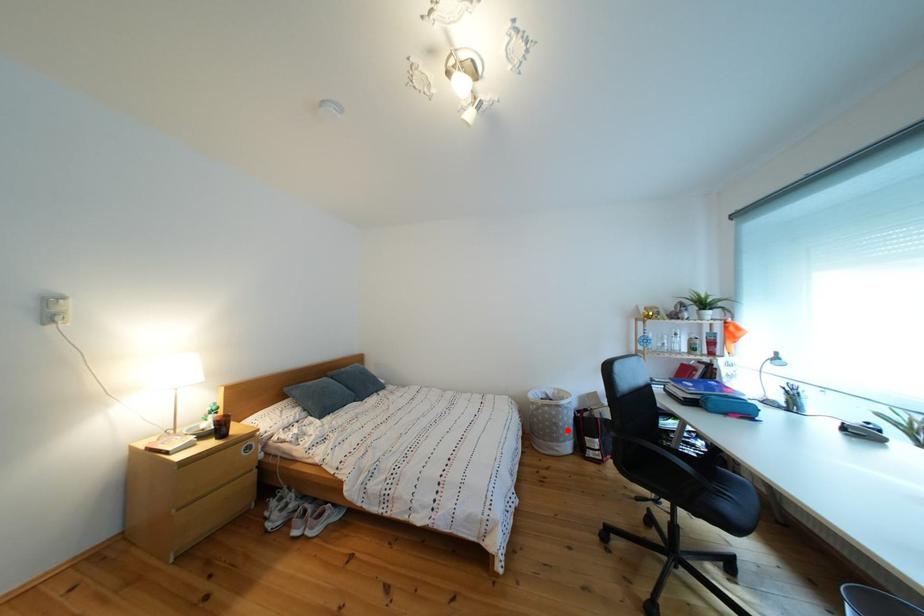
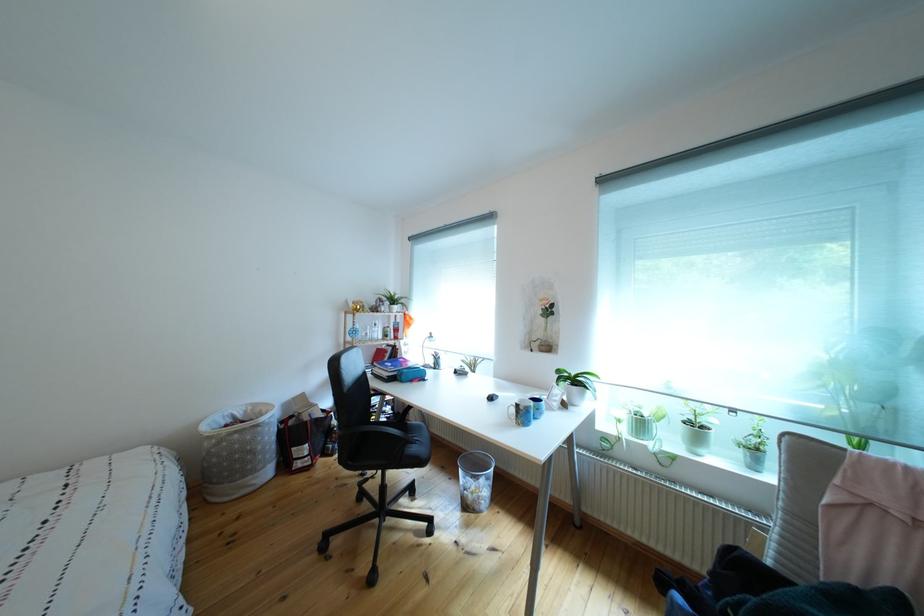
Question: I am providing you with two images of the same scene from different viewpoints. Image1 has a red point marked. In image2, the corresponding 3D location appears at what relative position? Reply with the corresponding letter.

Choices:
 (A) Closer
 (B) Farther

Answer: (A)